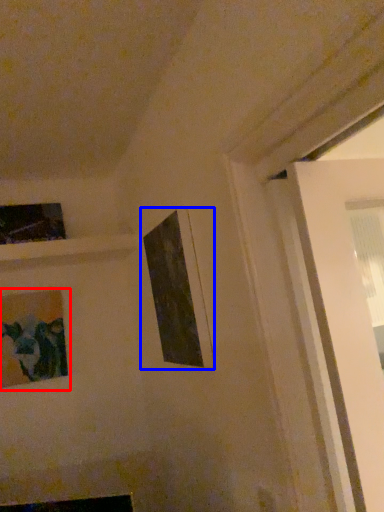
Question: Which point is closer to the camera, picture frame (highlighted by a red box) or picture frame (highlighted by a blue box)?

Choices:
 (A) picture frame
 (B) picture frame

Answer: (B)